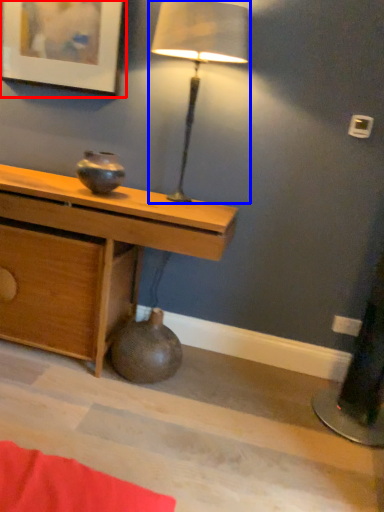
Question: Among these objects, which one is farthest to the camera, picture frame (highlighted by a red box) or lamp (highlighted by a blue box)?

Choices:
 (A) picture frame
 (B) lamp

Answer: (A)